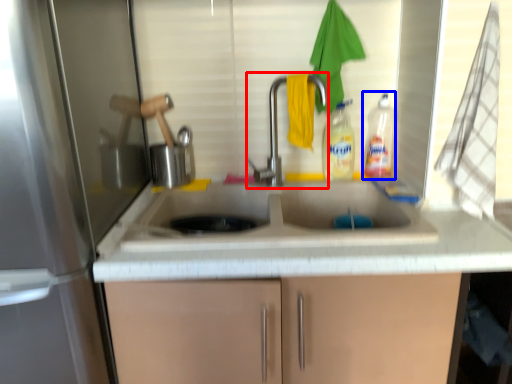
Question: Which of the following is the closest to the observer, tap (highlighted by a red box) or bottle (highlighted by a blue box)?

Choices:
 (A) tap
 (B) bottle

Answer: (A)